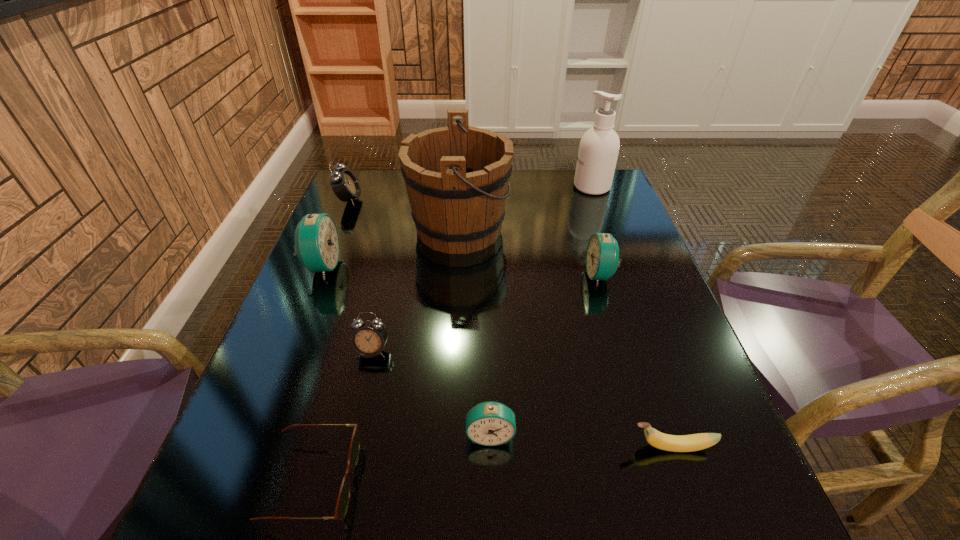
Find the location of a particular element. The height and width of the screenshot is (540, 960). vacant region located 0.350m at the front view of the brown spectacles is located at coordinates (573, 481).

Find the location of a particular element. The height and width of the screenshot is (540, 960). cleansing agent located in the far edge section of the desktop is located at coordinates (598, 151).

Locate an element on the screen. wine bucket located at the far edge is located at coordinates (457, 177).

Find the location of `alarm clock located in the far edge section of the desktop`. alarm clock located in the far edge section of the desktop is located at coordinates (345, 185).

The height and width of the screenshot is (540, 960). Find the location of `object that is positioned at the near edge`. object that is positioned at the near edge is located at coordinates (344, 494).

The width and height of the screenshot is (960, 540). Find the location of `spectacles that is positioned at the left edge`. spectacles that is positioned at the left edge is located at coordinates (344, 494).

What are the coordinates of `cleansing agent that is at the right edge` in the screenshot? It's located at (598, 151).

The width and height of the screenshot is (960, 540). In order to click on alarm clock that is at the right edge in this screenshot , I will do `click(602, 256)`.

Where is `banana located in the right edge section of the desktop`? banana located in the right edge section of the desktop is located at coordinates (676, 443).

Where is `object at the far left corner`? The width and height of the screenshot is (960, 540). object at the far left corner is located at coordinates (345, 185).